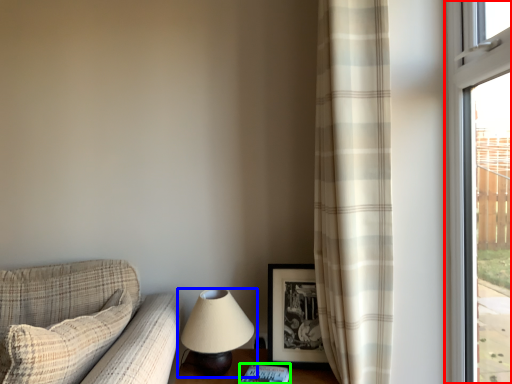
Question: Which object is the farthest from window (highlighted by a red box)? Choose among these: lamp (highlighted by a blue box) or book (highlighted by a green box).

Choices:
 (A) lamp
 (B) book

Answer: (B)